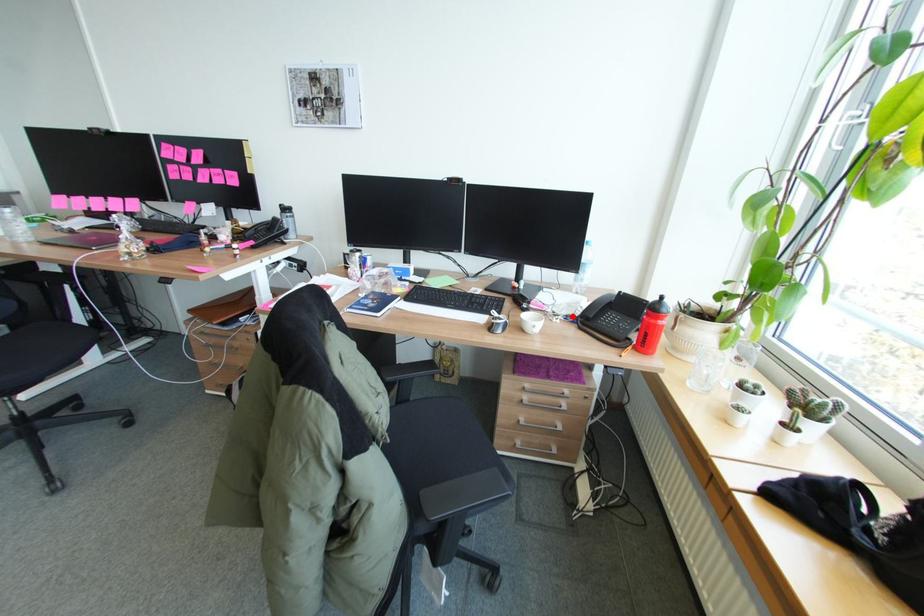
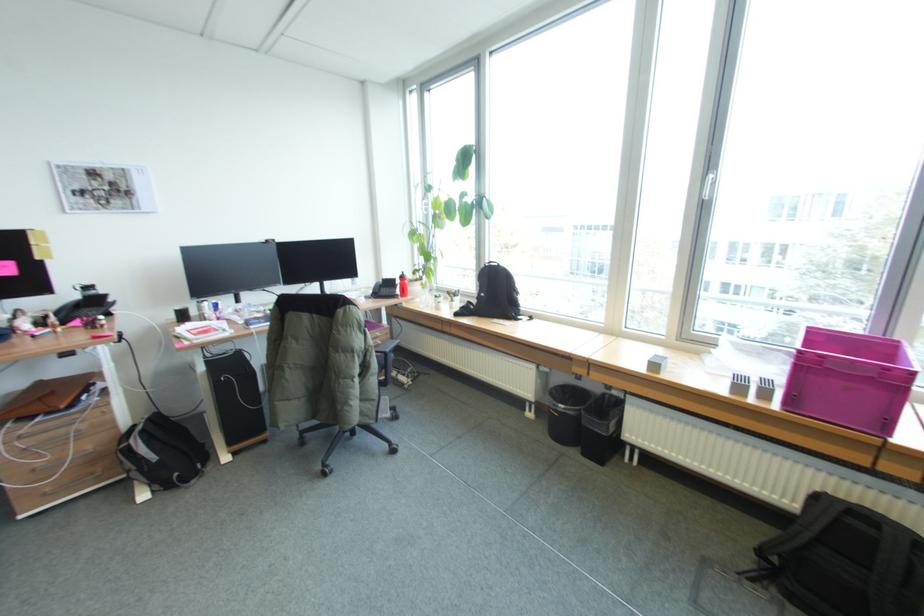
Where in the second image is the point corresponding to the highlighted location from the first image?

(370, 297)